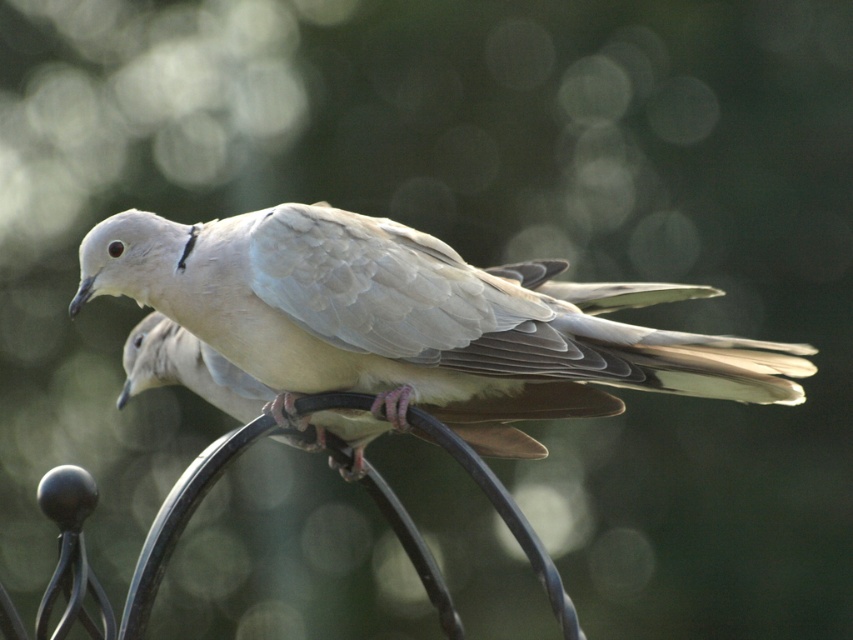
Is point (344, 355) less distant than point (216, 356)?

That is True.

Is matte white dove at center positioned in front of light gray feathered bird at center?

Yes, it is.

At what (x,y) coordinates should I click in order to perform the action: click on matte white dove at center. Please return your answer as a coordinate pair (x, y). Looking at the image, I should click on (409, 324).